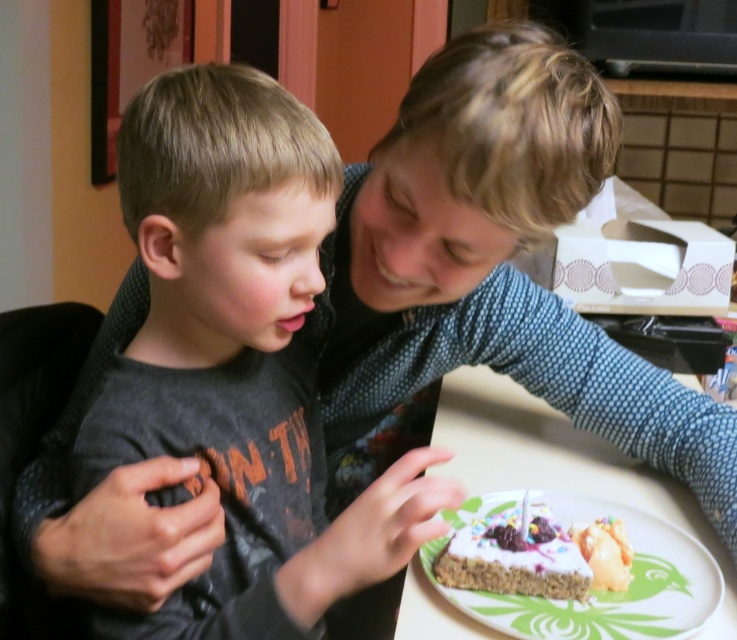
Is white frosted cake at lower center shorter than white frosted cake at center?

No.

Between white frosted cake at lower center and white frosted cake at center, which one is positioned lower?

white frosted cake at lower center is lower down.

Between point (450, 524) and point (511, 556), which one is positioned in front?

Point (511, 556) is in front.

Identify the location of white frosted cake at lower center. Image resolution: width=737 pixels, height=640 pixels. (604, 592).

Which is more to the left, dark gray shirt at center or white frosted cake at lower center?

dark gray shirt at center

Between dark gray shirt at center and white frosted cake at lower center, which one has less height?

white frosted cake at lower center

Is point (217, 221) positioned behind point (453, 516)?

No.

What are the coordinates of `dark gray shirt at center` in the screenshot? It's located at (242, 344).

Can you confirm if dark gray shirt at center is positioned to the right of white frosted cake at center?

In fact, dark gray shirt at center is to the left of white frosted cake at center.

Is point (234, 257) closer to camera compared to point (551, 541)?

Yes, point (234, 257) is in front of point (551, 541).

Find the location of a particular element. The image size is (737, 640). dark gray shirt at center is located at coordinates (242, 344).